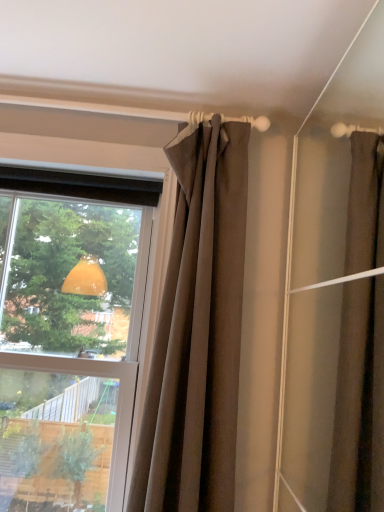
Question: From the image's perspective, is transparent glass window at upper left below brown fabric curtain at upper center?

Choices:
 (A) no
 (B) yes

Answer: (B)

Question: Is transparent glass window at upper left shorter than brown fabric curtain at upper center?

Choices:
 (A) no
 (B) yes

Answer: (A)

Question: Does transparent glass window at upper left come in front of brown fabric curtain at upper center?

Choices:
 (A) no
 (B) yes

Answer: (A)

Question: From the image's perspective, is transparent glass window at upper left on top of brown fabric curtain at upper center?

Choices:
 (A) no
 (B) yes

Answer: (A)

Question: Is transparent glass window at upper left with brown fabric curtain at upper center?

Choices:
 (A) no
 (B) yes

Answer: (A)

Question: Is transparent glass window at upper left smaller than brown fabric curtain at upper center?

Choices:
 (A) yes
 (B) no

Answer: (B)

Question: From a real-world perspective, is brown fabric curtain at upper center positioned over transparent glass window at upper left based on gravity?

Choices:
 (A) no
 (B) yes

Answer: (B)

Question: Could transparent glass window at upper left be considered to be inside brown fabric curtain at upper center?

Choices:
 (A) yes
 (B) no

Answer: (B)

Question: Is brown fabric curtain at upper center wider than transparent glass window at upper left?

Choices:
 (A) no
 (B) yes

Answer: (A)

Question: Would you consider brown fabric curtain at upper center to be distant from transparent glass window at upper left?

Choices:
 (A) yes
 (B) no

Answer: (B)

Question: Is brown fabric curtain at upper center facing towards transparent glass window at upper left?

Choices:
 (A) no
 (B) yes

Answer: (A)

Question: Considering the relative positions of brown fabric curtain at upper center and transparent glass window at upper left in the image provided, is brown fabric curtain at upper center behind transparent glass window at upper left?

Choices:
 (A) yes
 (B) no

Answer: (B)

Question: Based on their positions, is transparent glass window at upper left located to the left or right of brown fabric curtain at upper center?

Choices:
 (A) left
 (B) right

Answer: (A)